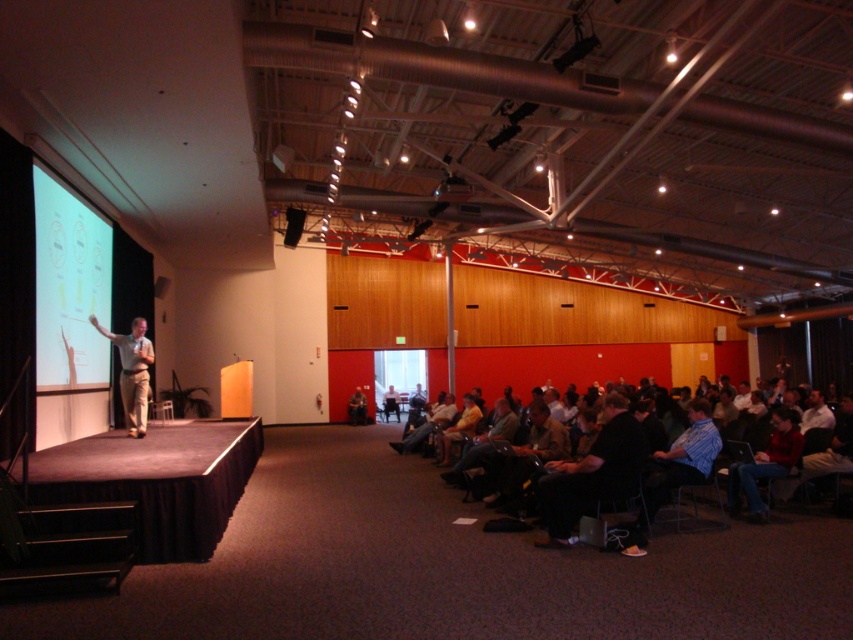
Can you confirm if dark brown leather chairs at lower center is positioned below matte white projection screen at left?

Indeed, dark brown leather chairs at lower center is positioned under matte white projection screen at left.

Describe the element at coordinates (624, 470) in the screenshot. I see `dark brown leather chairs at lower center` at that location.

Does point (556, 538) come behind point (80, 365)?

No, (556, 538) is closer to viewer.

You are a GUI agent. You are given a task and a screenshot of the screen. Output one action in this format:
    pyautogui.click(x=<x>, y=<y>)
    Task: Click on the dark brown leather chairs at lower center
    Image resolution: width=853 pixels, height=640 pixels.
    Given the screenshot: What is the action you would take?
    624,470

Is point (543, 544) closer to viewer compared to point (144, 432)?

Yes, it is.

Can you confirm if dark brown leather chairs at lower center is bigger than light brown casual wear at stage left?

No, dark brown leather chairs at lower center is not bigger than light brown casual wear at stage left.

Which is in front, point (680, 484) or point (125, 394)?

Positioned in front is point (680, 484).

You are a GUI agent. You are given a task and a screenshot of the screen. Output one action in this format:
    pyautogui.click(x=<x>, y=<y>)
    Task: Click on the dark brown leather chairs at lower center
    The image size is (853, 640).
    Given the screenshot: What is the action you would take?
    pyautogui.click(x=624, y=470)

Which is above, matte white projection screen at left or light brown casual wear at stage left?

Positioned higher is matte white projection screen at left.

Between matte white projection screen at left and light brown casual wear at stage left, which one is positioned lower?

Positioned lower is light brown casual wear at stage left.

At what (x,y) coordinates should I click in order to perform the action: click on matte white projection screen at left. Please return your answer as a coordinate pair (x, y). The image size is (853, 640). Looking at the image, I should click on (68, 288).

I want to click on matte white projection screen at left, so click(x=68, y=288).